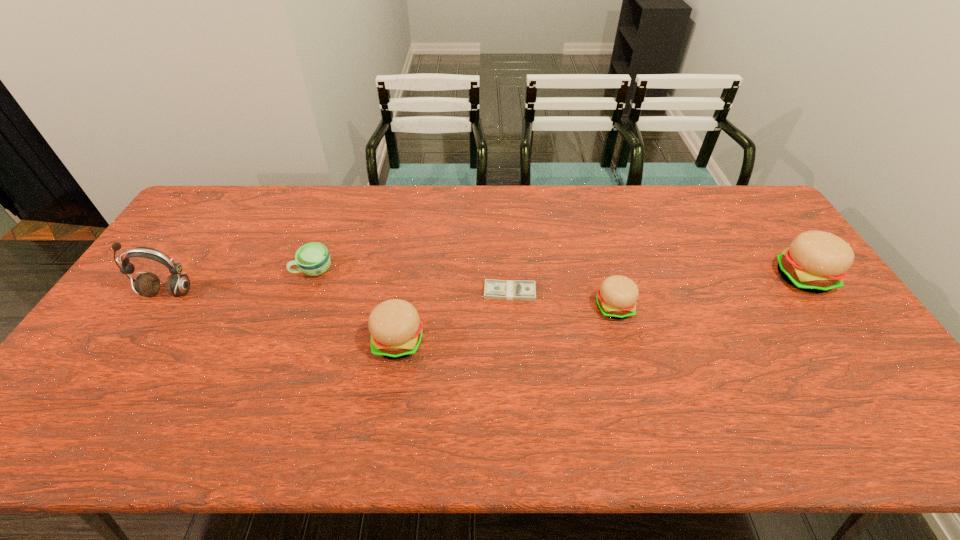
Identify the location of the third object from left to right. The width and height of the screenshot is (960, 540). (396, 330).

At what (x,y) coordinates should I click in order to perform the action: click on the fourth shortest object. Please return your answer as a coordinate pair (x, y). The height and width of the screenshot is (540, 960). Looking at the image, I should click on (396, 330).

Locate an element on the screen. This screenshot has height=540, width=960. the second hamburger from right to left is located at coordinates (616, 298).

Where is `the fourth tallest object`? The image size is (960, 540). the fourth tallest object is located at coordinates (616, 298).

This screenshot has width=960, height=540. Identify the location of the fifth shortest object. (816, 262).

The height and width of the screenshot is (540, 960). In order to click on the rightmost object in this screenshot , I will do `click(816, 262)`.

Where is `cup`? cup is located at coordinates (313, 259).

Find the location of a particular element. Image resolution: width=960 pixels, height=540 pixels. the fifth object from right to left is located at coordinates (313, 259).

This screenshot has height=540, width=960. In order to click on the leftmost object in this screenshot , I will do `click(148, 284)`.

At what (x,y) coordinates should I click in order to perform the action: click on the tallest object. Please return your answer as a coordinate pair (x, y). Image resolution: width=960 pixels, height=540 pixels. Looking at the image, I should click on (148, 284).